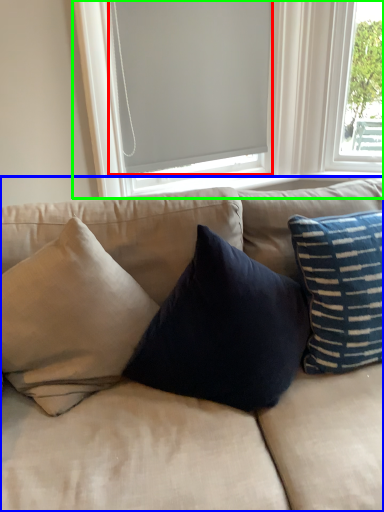
Question: Which object is the closest to the window screen (highlighted by a red box)? Choose among these: studio couch (highlighted by a blue box) or window (highlighted by a green box).

Choices:
 (A) studio couch
 (B) window

Answer: (B)